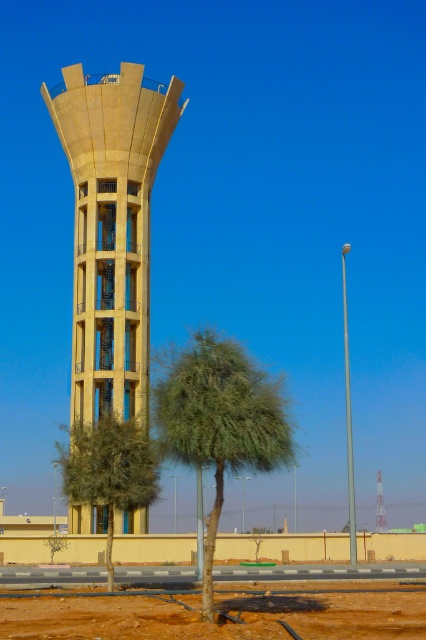
Is point (221, 337) more distant than point (109, 424)?

That is False.

Who is more forward, (201, 547) or (146, 429)?

Positioned in front is point (146, 429).

Who is more distant from viewer, [291,456] or [85,486]?

The point [85,486] is behind.

Where is `green leafy tree at center`? Image resolution: width=426 pixels, height=640 pixels. green leafy tree at center is located at coordinates (219, 422).

Does beige concrete tower at center have a lesser height compared to green leafy tree at lower center?

Incorrect, beige concrete tower at center's height does not fall short of green leafy tree at lower center's.

Does point (77, 65) come farther from viewer compared to point (106, 442)?

Yes, it is behind point (106, 442).

You are a GUI agent. You are given a task and a screenshot of the screen. Output one action in this format:
    pyautogui.click(x=<x>, y=<y>)
    Task: Click on the beige concrete tower at center
    
    Given the screenshot: What is the action you would take?
    pyautogui.click(x=112, y=227)

Is the position of beige concrete tower at center more distant than that of green leafy tree at center?

That is True.

The height and width of the screenshot is (640, 426). In order to click on beige concrete tower at center in this screenshot , I will do `click(112, 227)`.

Between point (118, 317) and point (207, 564), which one is positioned behind?

Point (118, 317)

I want to click on beige concrete tower at center, so click(x=112, y=227).